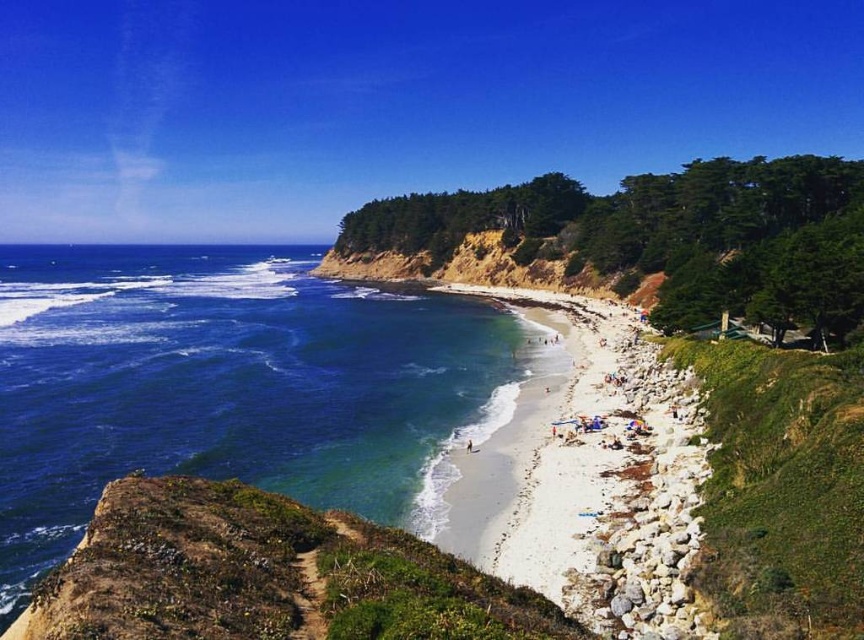
Question: Among these objects, which one is nearest to the camera?

Choices:
 (A) blue water at lower left
 (B) green mossy cliff at lower left
 (C) white sand beach at center

Answer: (B)

Question: Does blue water at lower left appear under green mossy cliff at lower left?

Choices:
 (A) yes
 (B) no

Answer: (B)

Question: Is blue water at lower left bigger than white sand beach at center?

Choices:
 (A) no
 (B) yes

Answer: (B)

Question: Which of the following is the farthest from the observer?

Choices:
 (A) (194, 522)
 (B) (261, 289)
 (C) (639, 513)

Answer: (B)

Question: Which object is positioned farthest from the white sand beach at center?

Choices:
 (A) blue water at lower left
 (B) green mossy cliff at lower left

Answer: (A)

Question: Is blue water at lower left bigger than green mossy cliff at lower left?

Choices:
 (A) no
 (B) yes

Answer: (B)